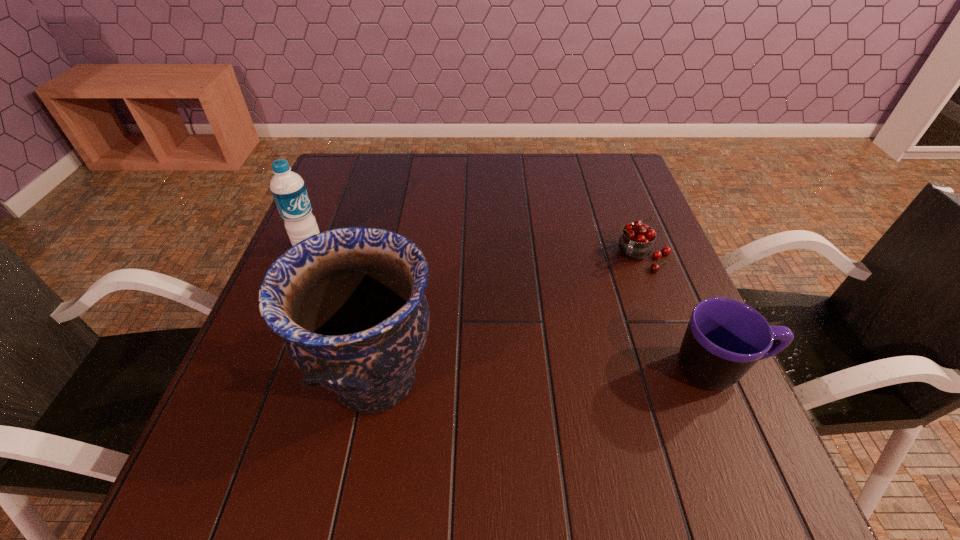
The height and width of the screenshot is (540, 960). I want to click on the third object from right to left, so click(349, 303).

Identify the location of mug. This screenshot has width=960, height=540. (725, 338).

At what (x,y) coordinates should I click in order to perform the action: click on pot filled with cherries. Please return your answer as a coordinate pair (x, y). Looking at the image, I should click on (636, 242).

Identify the location of water bottle. (288, 189).

Where is `vacant area located on the front handle of the third object from right to left`? vacant area located on the front handle of the third object from right to left is located at coordinates (622, 380).

Find the location of a particular element. vacant region located on the handle side of the pot filled with cherries is located at coordinates (597, 328).

At what (x,y) coordinates should I click in order to perform the action: click on vacant position located 0.360m on the handle side of the pot filled with cherries. Please return your answer as a coordinate pair (x, y). Looking at the image, I should click on pos(564,384).

This screenshot has height=540, width=960. I want to click on vacant space located 0.200m on the handle side of the pot filled with cherries, so click(597, 328).

Locate an element on the screen. free region located 0.280m on the label of the leftmost object is located at coordinates (398, 309).

Locate an element on the screen. The image size is (960, 540). free region located 0.140m on the label of the leftmost object is located at coordinates (356, 280).